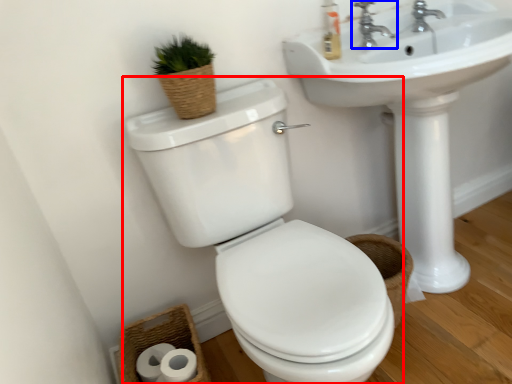
Question: Among these objects, which one is nearest to the camera, toilet (highlighted by a red box) or tap (highlighted by a blue box)?

Choices:
 (A) toilet
 (B) tap

Answer: (A)